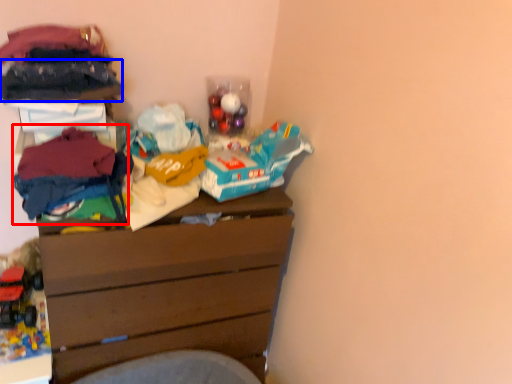
Question: Which object appears closest to the camera in this image, clothing (highlighted by a red box) or clothing (highlighted by a blue box)?

Choices:
 (A) clothing
 (B) clothing

Answer: (A)